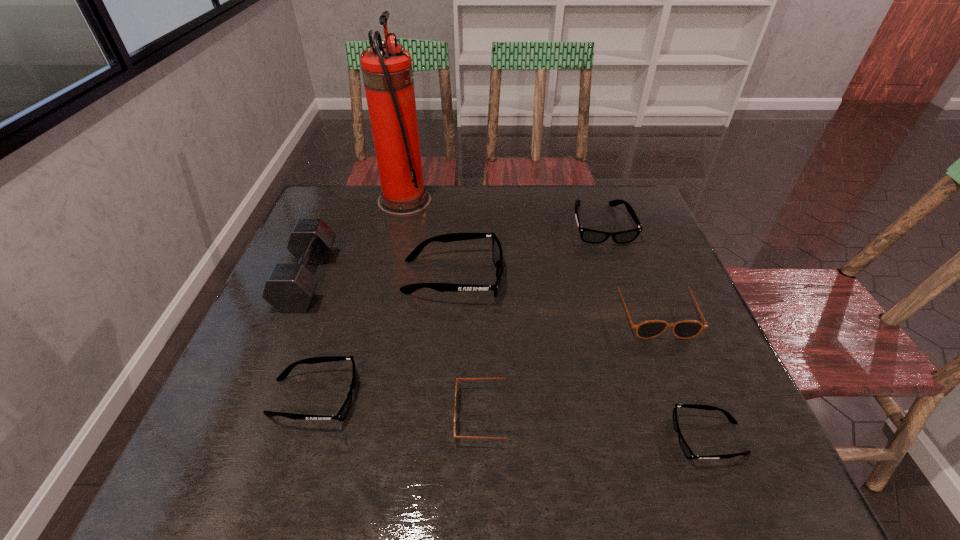
The image size is (960, 540). I want to click on vacant space situated on the front-facing side of the nearer brown sunglasses, so click(x=276, y=415).

At what (x,y) coordinates should I click in order to perform the action: click on free space located 0.210m on the front-facing side of the nearer brown sunglasses. Please return your answer as a coordinate pair (x, y). Image resolution: width=960 pixels, height=540 pixels. Looking at the image, I should click on (345, 415).

You are a GUI agent. You are given a task and a screenshot of the screen. Output one action in this format:
    pyautogui.click(x=<x>, y=<y>)
    Task: Click on the vacant space located 0.250m on the front-facing side of the leftmost black sunglasses
    
    Given the screenshot: What is the action you would take?
    pyautogui.click(x=484, y=397)

Identify the location of vacant space situated 0.320m on the front-facing side of the shortest object. point(498,438).

Image resolution: width=960 pixels, height=540 pixels. I want to click on vacant area situated on the front-facing side of the shortest object, so click(x=510, y=438).

At what (x,y) coordinates should I click in order to perform the action: click on free region located on the front-facing side of the shortest object. Please return your answer as a coordinate pair (x, y). The image size is (960, 540). Looking at the image, I should click on (460, 438).

This screenshot has width=960, height=540. What are the coordinates of `fire extinguisher located in the far edge section of the desktop` in the screenshot? It's located at (x=387, y=72).

Find the location of a particular element. The height and width of the screenshot is (540, 960). sunglasses located at the far edge is located at coordinates (587, 235).

The width and height of the screenshot is (960, 540). Identify the location of dumbbell at the left edge. (289, 288).

Where is `sunglasses that is at the left edge`? Image resolution: width=960 pixels, height=540 pixels. sunglasses that is at the left edge is located at coordinates (342, 413).